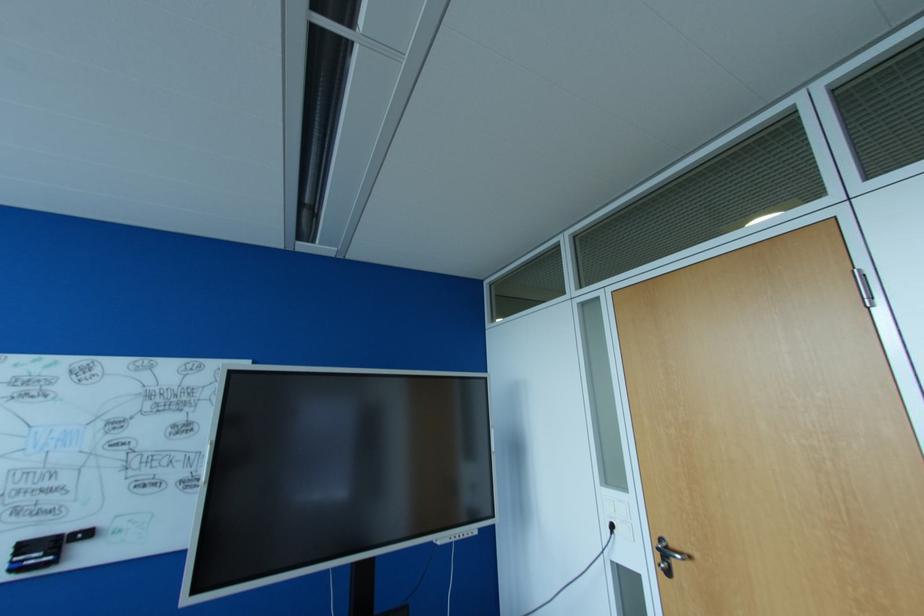
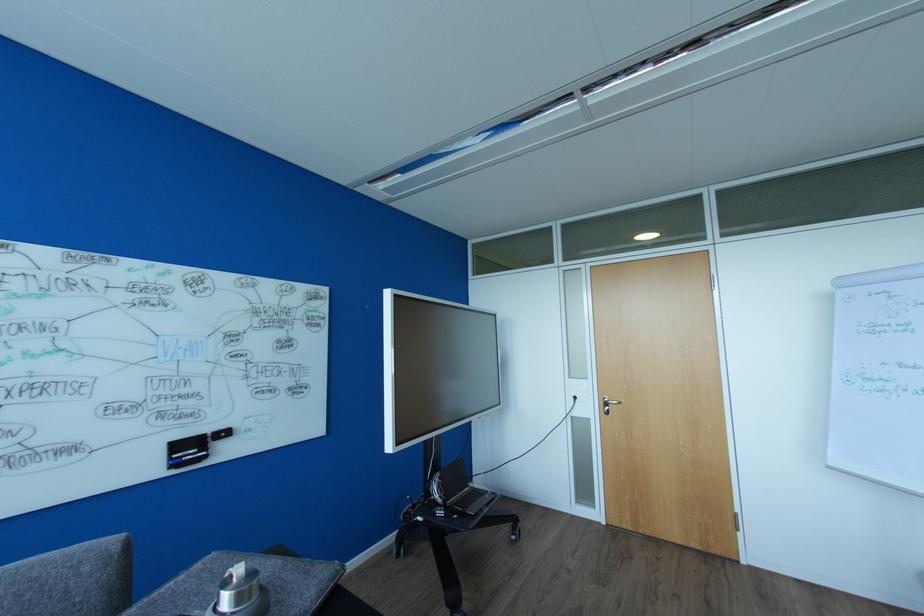
Locate, in the second image, the point that corresponds to the point at 669,553 in the first image.

(610, 403)